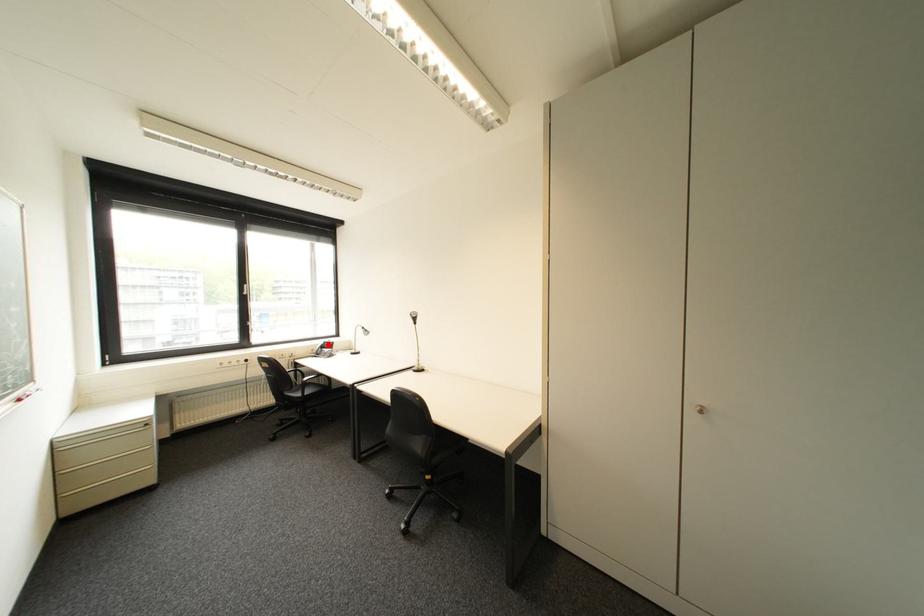
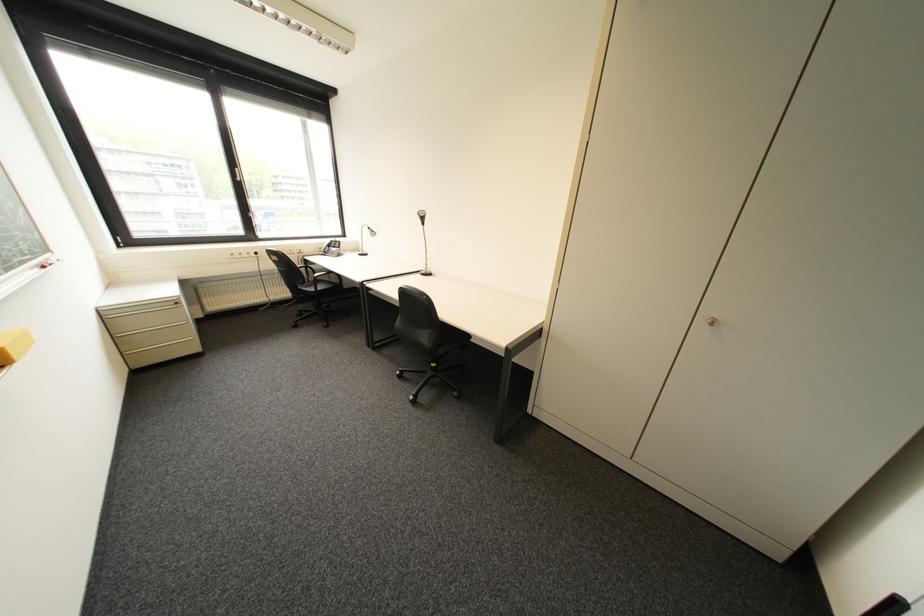
Locate, in the second image, the point that corresponds to the highlighted location in the first image.

(335, 244)